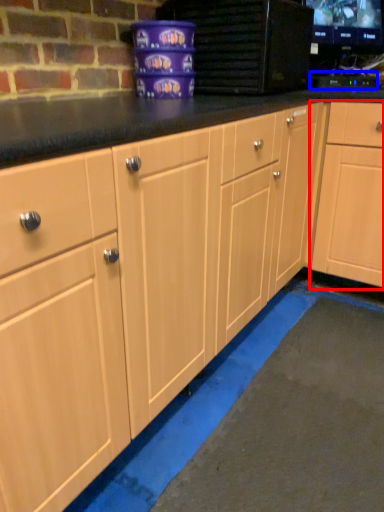
Question: Which object is closer to the camera taking this photo, cabinetry (highlighted by a red box) or appliance (highlighted by a blue box)?

Choices:
 (A) cabinetry
 (B) appliance

Answer: (A)